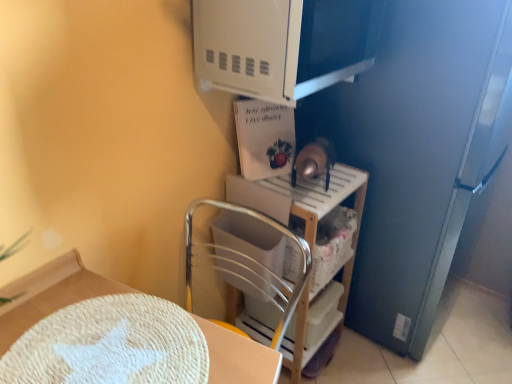
At what (x,y) coordinates should I click in order to perform the action: click on vacant area on top of white woven placemat at lower left (from a real-world perspective). Please return your answer as a coordinate pair (x, y). Image resolution: width=512 pixels, height=384 pixels. Looking at the image, I should click on (116, 345).